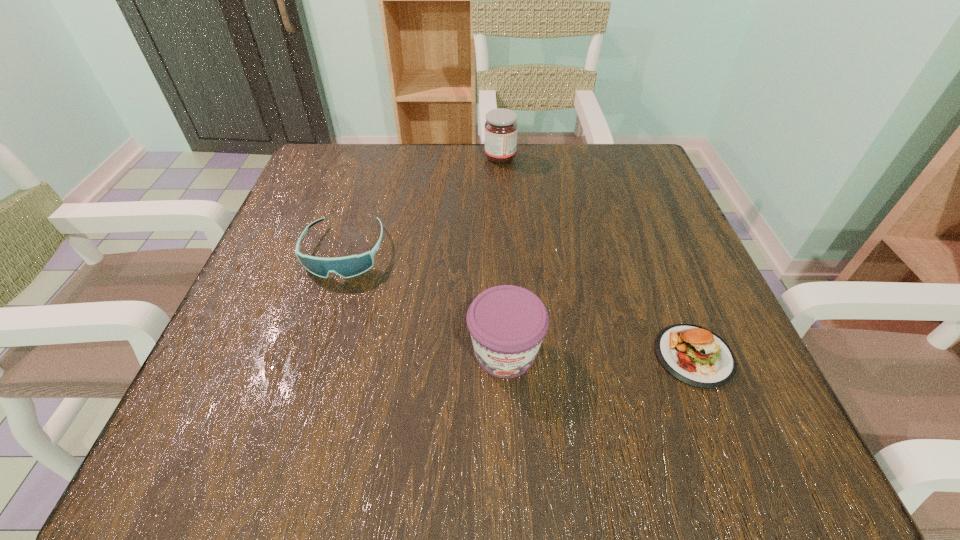
Where is `object that is at the far edge`? The width and height of the screenshot is (960, 540). object that is at the far edge is located at coordinates [501, 128].

Locate an element on the screen. object that is positioned at the left edge is located at coordinates [x=350, y=266].

Where is `object that is at the right edge`? The image size is (960, 540). object that is at the right edge is located at coordinates (694, 355).

Identify the location of free space at the far edge. This screenshot has height=540, width=960. (561, 145).

What are the coordinates of `vacant space at the near edge of the desktop` in the screenshot? It's located at point(363,413).

The height and width of the screenshot is (540, 960). What are the coordinates of `free space at the left edge of the desktop` in the screenshot? It's located at (271, 279).

I want to click on vacant space at the right edge of the desktop, so click(735, 340).

Identify the location of blank area at the far left corner. coord(359,150).

Identify the location of vacant region at the near left corner of the desktop. [214, 469].

What are the coordinates of `vacant space at the far right corner of the desktop` in the screenshot? It's located at (647, 158).